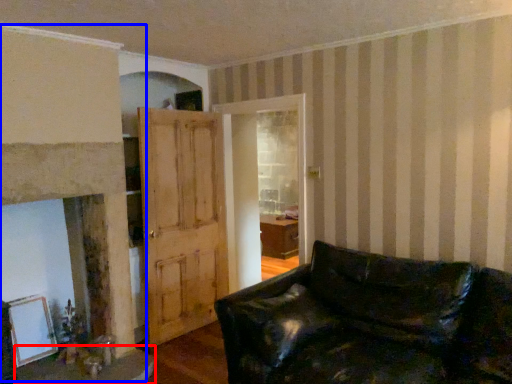
Question: Which point is closer to the camera, table (highlighted by a red box) or fireplace (highlighted by a blue box)?

Choices:
 (A) table
 (B) fireplace

Answer: (B)